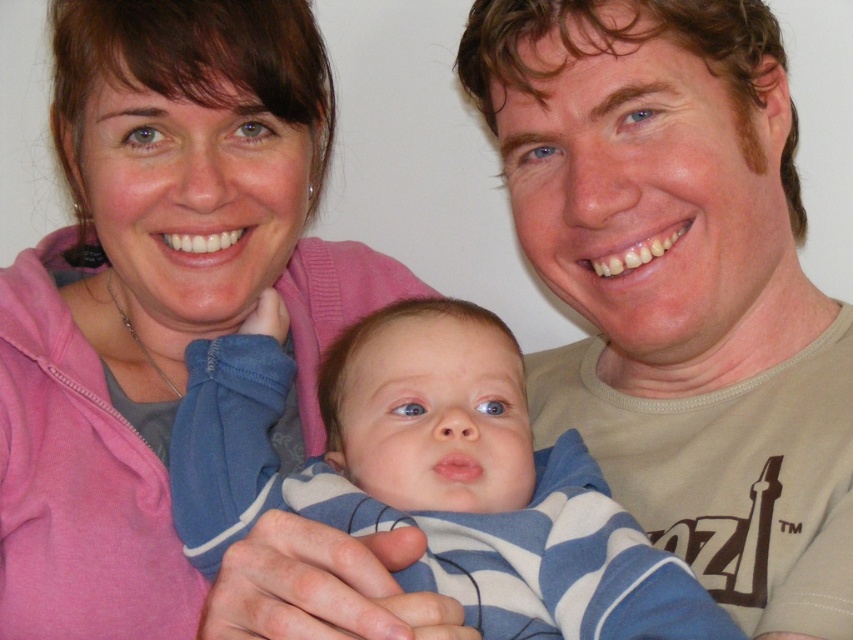
Does point (834, 616) come farther from viewer compared to point (358, 420)?

No, (834, 616) is in front of (358, 420).

Which is in front, point (798, 474) or point (393, 314)?

Positioned in front is point (798, 474).

Find the location of `matte beige t-shirt at center`. matte beige t-shirt at center is located at coordinates (682, 285).

Between point (172, 536) and point (523, 561), which one is positioned in front?

Positioned in front is point (523, 561).

Describe the element at coordinates (178, 330) in the screenshot. This screenshot has width=853, height=640. I see `pink fleece at upper left` at that location.

I want to click on pink fleece at upper left, so click(178, 330).

Is pink fleece at upper left bigger than matte beige t-shirt at center?

Yes, pink fleece at upper left is bigger than matte beige t-shirt at center.

Is pink fleece at upper left positioned before matte beige t-shirt at center?

No, it is behind matte beige t-shirt at center.

Measure the distance between pink fleece at upper left and camera.

They are 28.77 inches apart.

Locate an element on the screen. pink fleece at upper left is located at coordinates (178, 330).